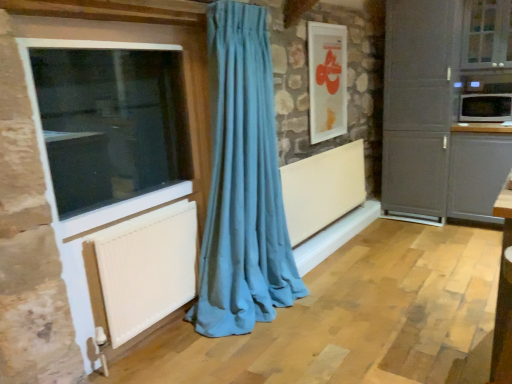
At what (x,y) coordinates should I click in order to perform the action: click on free spot to the right of teal fabric curtain at center. Please return your answer as a coordinate pair (x, y). Image resolution: width=512 pixels, height=384 pixels. Looking at the image, I should click on (338, 307).